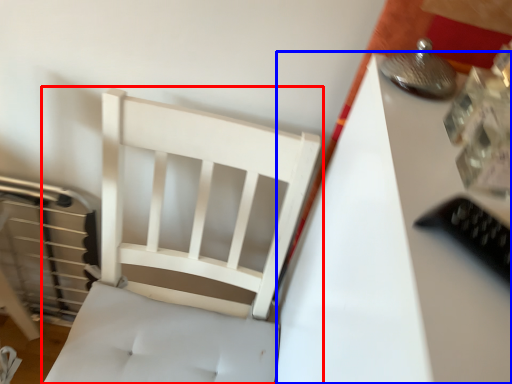
Question: Which object appears farthest to the camera in this image, furniture (highlighted by a red box) or table (highlighted by a blue box)?

Choices:
 (A) furniture
 (B) table

Answer: (A)